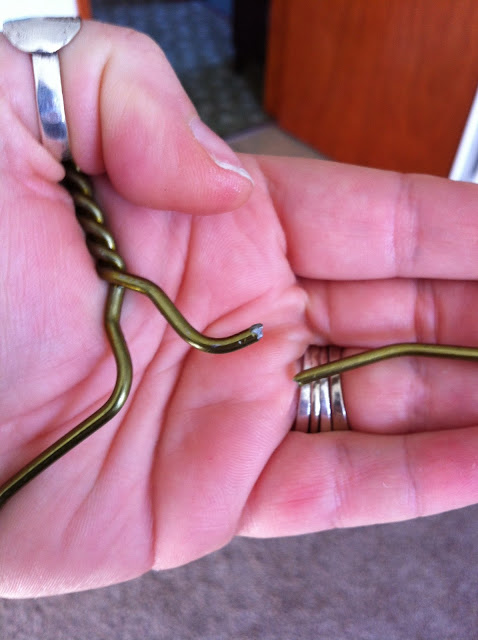
Find the location of a particular element. The image size is (478, 640). shadow on carpet is located at coordinates (232, 89).